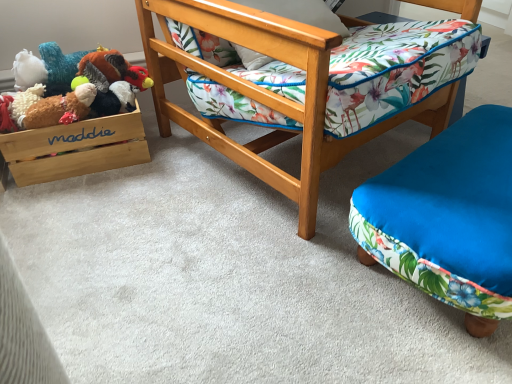
Question: From the image's perspective, is fluffy brown plush at left, acting as the 1th toy starting from the bottom, positioned above or below wooden/matte storage box at left?

Choices:
 (A) above
 (B) below

Answer: (A)

Question: Is point (51, 104) positioned closer to the camera than point (117, 134)?

Choices:
 (A) farther
 (B) closer

Answer: (B)

Question: Estimate the real-world distances between objects in this image. Which object is farther from the fluffy plush turkey at upper left, marked as the second toy in a bottom-to-top arrangement?

Choices:
 (A) blue fabric ottoman at lower right
 (B) wooden chair at center
 (C) wooden/matte storage box at left
 (D) fluffy brown plush at left, acting as the 1th toy starting from the bottom

Answer: (A)

Question: Which object is the farthest from the wooden/matte storage box at left?

Choices:
 (A) blue fabric ottoman at lower right
 (B) fluffy plush turkey at upper left, marked as the second toy in a bottom-to-top arrangement
 (C) fluffy brown plush at left, which is the second toy in top-to-bottom order
 (D) wooden chair at center

Answer: (A)